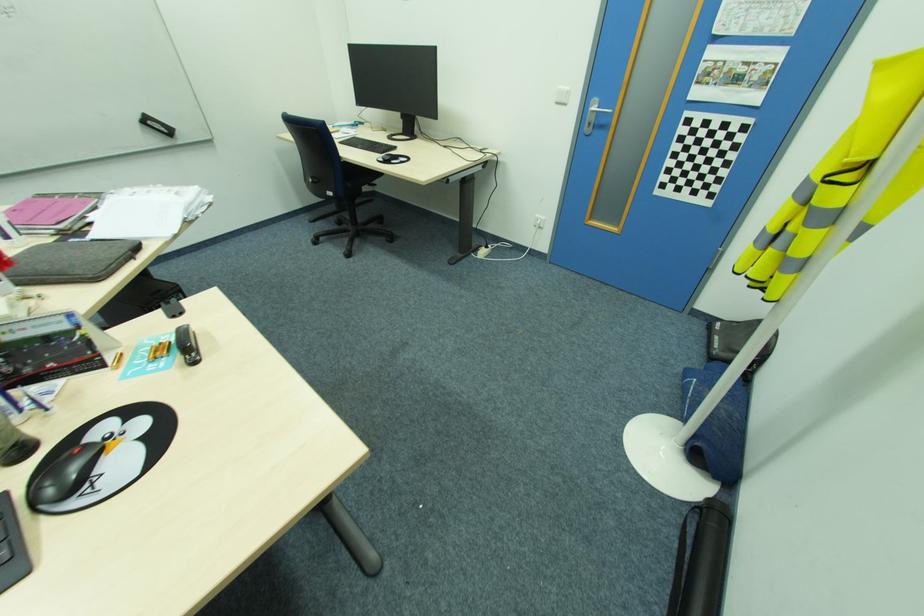
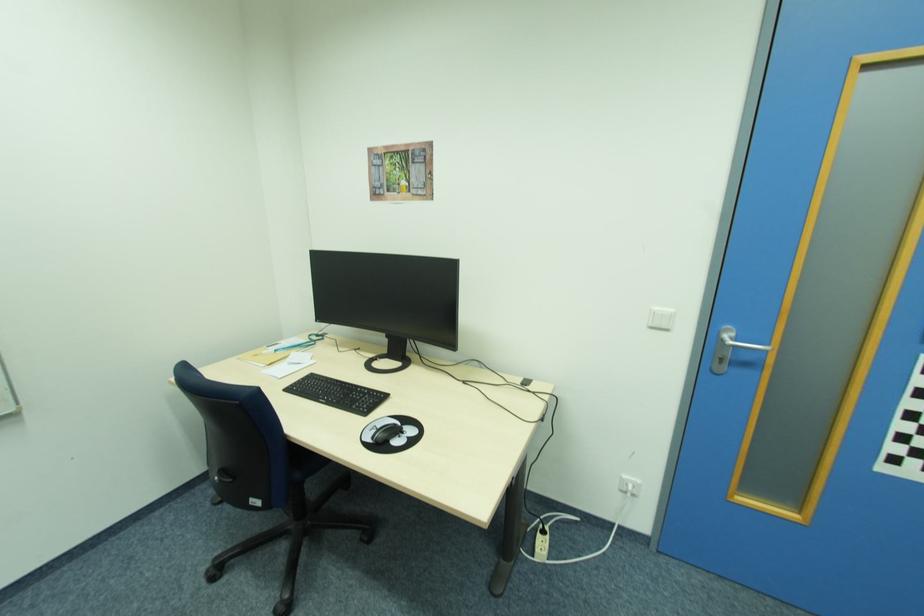
Locate, in the second image, the point that corresponds to (568,105) in the first image.

(670, 329)